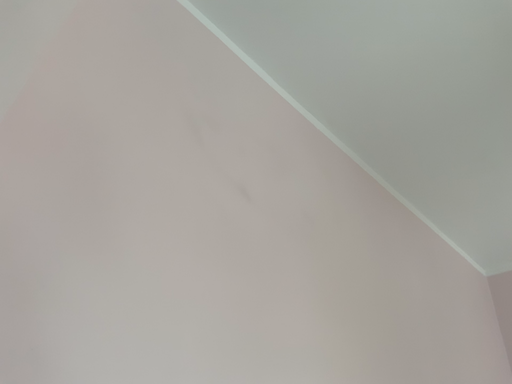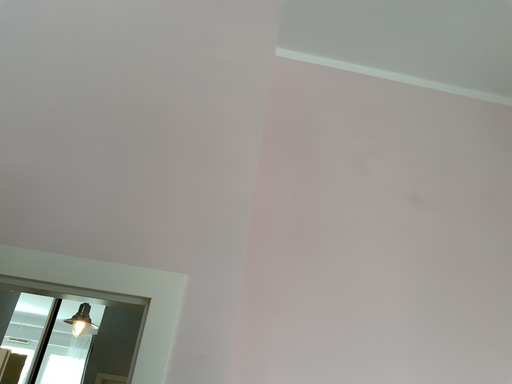
Question: Which way did the camera rotate in the video?

Choices:
 (A) rotated upward
 (B) rotated downward

Answer: (B)